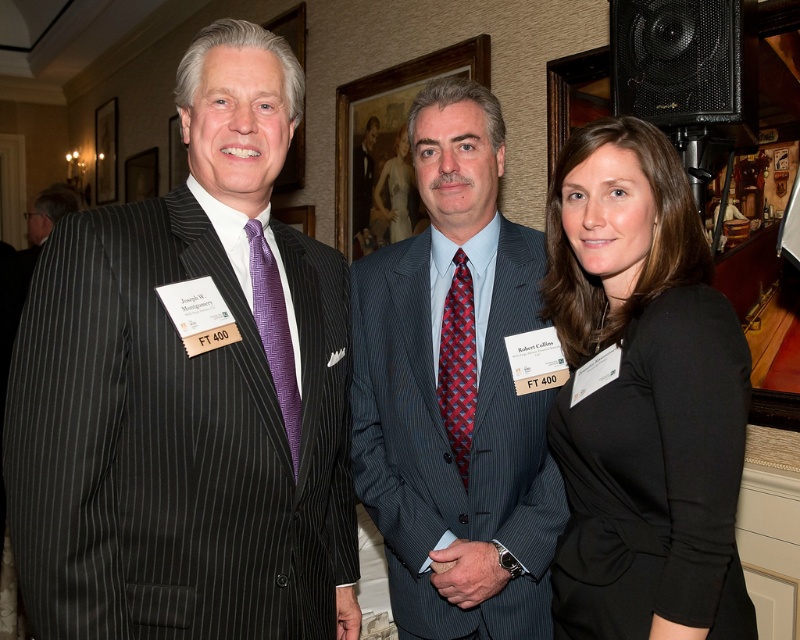
Question: Among these objects, which one is nearest to the camera?

Choices:
 (A) black matte dress at center
 (B) red plaid silk tie at center

Answer: (A)

Question: Can you confirm if black matte dress at center is smaller than smooth white dress at center?

Choices:
 (A) yes
 (B) no

Answer: (B)

Question: Is black matte dress at center thinner than smooth white dress at center?

Choices:
 (A) yes
 (B) no

Answer: (B)

Question: Which of the following is the closest to the observer?

Choices:
 (A) dark blue pinstripe suit at center
 (B) black matte dress at center
 (C) matte black suit at left

Answer: (C)

Question: Which point is farther from the camera taking this photo?

Choices:
 (A) (394, 225)
 (B) (442, 381)
 (C) (613, 401)
 (D) (102, 164)

Answer: (D)

Question: Is purple pinstripe tie at left positioned at the back of wooden picture frame at upper left?

Choices:
 (A) no
 (B) yes

Answer: (A)